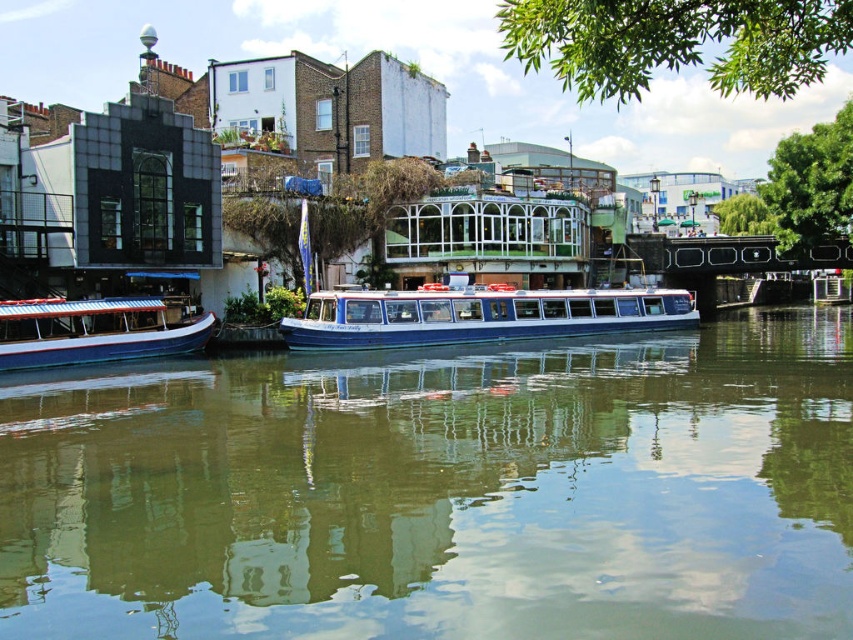
You are standing at point (x=440, y=490) in the image. What do you see directly in front of you?

You see green reflective water at center directly in front of you at point (x=440, y=490).

You are standing at the center of the image and want to locate the blue polished wood boat at center. According to the coordinates provided, where exactly would you find it?

The blue polished wood boat at center is located at coordinates point (x=477, y=316).